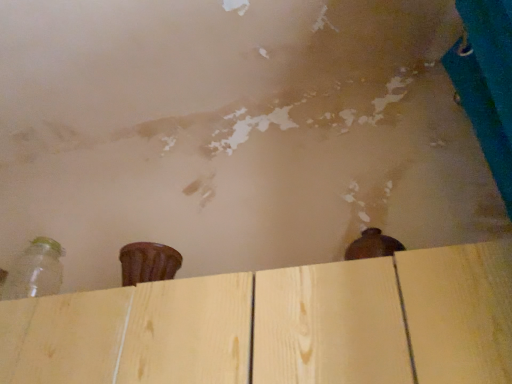
Question: Is transparent glass bottle at lower left positioned before natural wood plywood at center?

Choices:
 (A) yes
 (B) no

Answer: (B)

Question: Can you see transparent glass bottle at lower left touching natural wood plywood at center?

Choices:
 (A) yes
 (B) no

Answer: (B)

Question: From the image's perspective, is transparent glass bottle at lower left on top of natural wood plywood at center?

Choices:
 (A) no
 (B) yes

Answer: (B)

Question: Is transparent glass bottle at lower left far from natural wood plywood at center?

Choices:
 (A) no
 (B) yes

Answer: (A)

Question: Does transparent glass bottle at lower left come behind natural wood plywood at center?

Choices:
 (A) yes
 (B) no

Answer: (A)

Question: Is natural wood plywood at center completely or partially inside transparent glass bottle at lower left?

Choices:
 (A) no
 (B) yes

Answer: (A)

Question: From the image's perspective, is natural wood plywood at center located beneath transparent glass bottle at lower left?

Choices:
 (A) no
 (B) yes

Answer: (B)

Question: Is natural wood plywood at center closer to the viewer compared to transparent glass bottle at lower left?

Choices:
 (A) yes
 (B) no

Answer: (A)

Question: From a real-world perspective, is natural wood plywood at center below transparent glass bottle at lower left?

Choices:
 (A) yes
 (B) no

Answer: (A)

Question: Is natural wood plywood at center outside of transparent glass bottle at lower left?

Choices:
 (A) no
 (B) yes

Answer: (B)

Question: Is natural wood plywood at center aimed at transparent glass bottle at lower left?

Choices:
 (A) no
 (B) yes

Answer: (A)

Question: Can you confirm if natural wood plywood at center is bigger than transparent glass bottle at lower left?

Choices:
 (A) no
 (B) yes

Answer: (B)

Question: In terms of size, does natural wood plywood at center appear bigger or smaller than transparent glass bottle at lower left?

Choices:
 (A) big
 (B) small

Answer: (A)